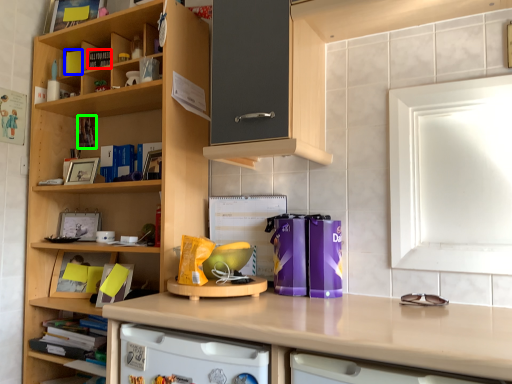
Question: Considering the real-world distances, which object is closest to book (highlighted by a red box)? book (highlighted by a blue box) or book (highlighted by a green box).

Choices:
 (A) book
 (B) book

Answer: (A)